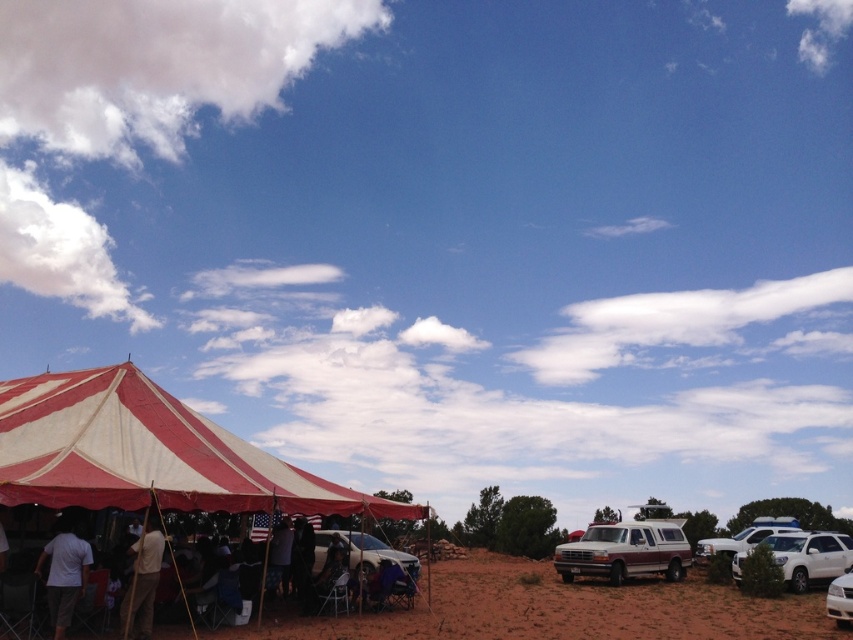
Is point (277, 580) farther from camera compared to point (844, 605)?

Yes, it is.

Which of these two, dark gray fabric at center or white glossy sedan at lower right, stands shorter?

dark gray fabric at center is shorter.

Locate an element on the screen. Image resolution: width=853 pixels, height=640 pixels. dark gray fabric at center is located at coordinates (279, 554).

Who is positioned more to the right, metallic silver car at center or white matte police car at right?

From the viewer's perspective, white matte police car at right appears more on the right side.

Is point (325, 544) closer to viewer compared to point (722, 538)?

Yes, point (325, 544) is in front of point (722, 538).

Where is `metallic silver car at center`? Image resolution: width=853 pixels, height=640 pixels. metallic silver car at center is located at coordinates (363, 552).

Does red and white striped tent at lower left appear on the right side of white matte police car at right?

No, red and white striped tent at lower left is not to the right of white matte police car at right.

Is red and white striped tent at lower left to the left of white matte police car at right from the viewer's perspective?

Yes, red and white striped tent at lower left is to the left of white matte police car at right.

Which is behind, point (15, 476) or point (735, 547)?

Positioned behind is point (735, 547).

This screenshot has width=853, height=640. What are the coordinates of `red and white striped tent at lower left` in the screenshot? It's located at (148, 452).